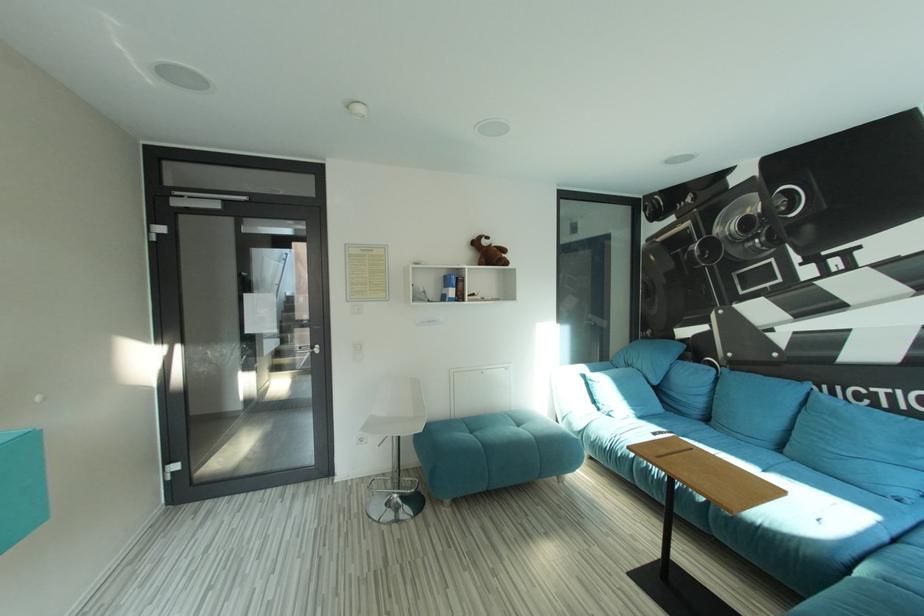
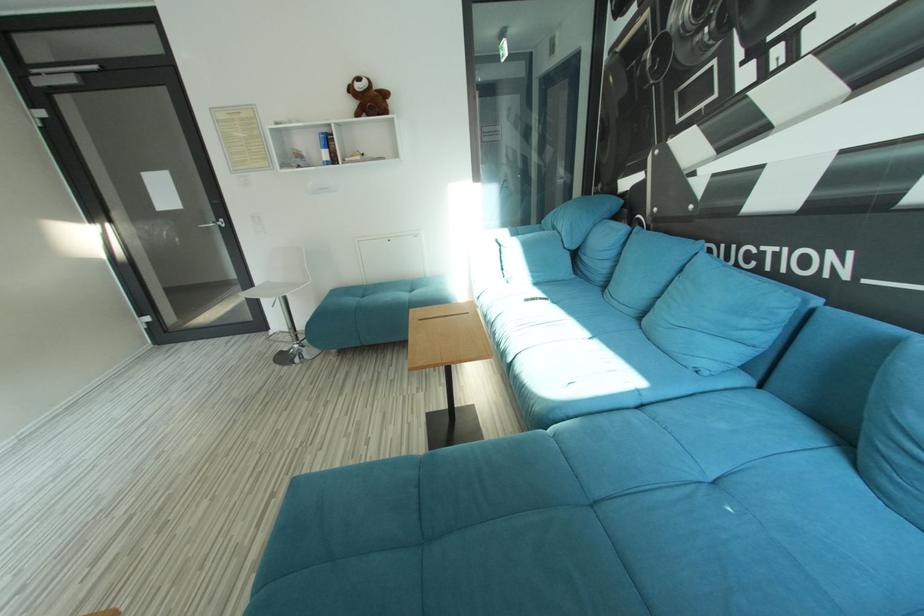
Question: The images are taken continuously from a first-person perspective. In which direction are you moving?

Choices:
 (A) Left
 (B) Right
 (C) Forward
 (D) Backward

Answer: (B)